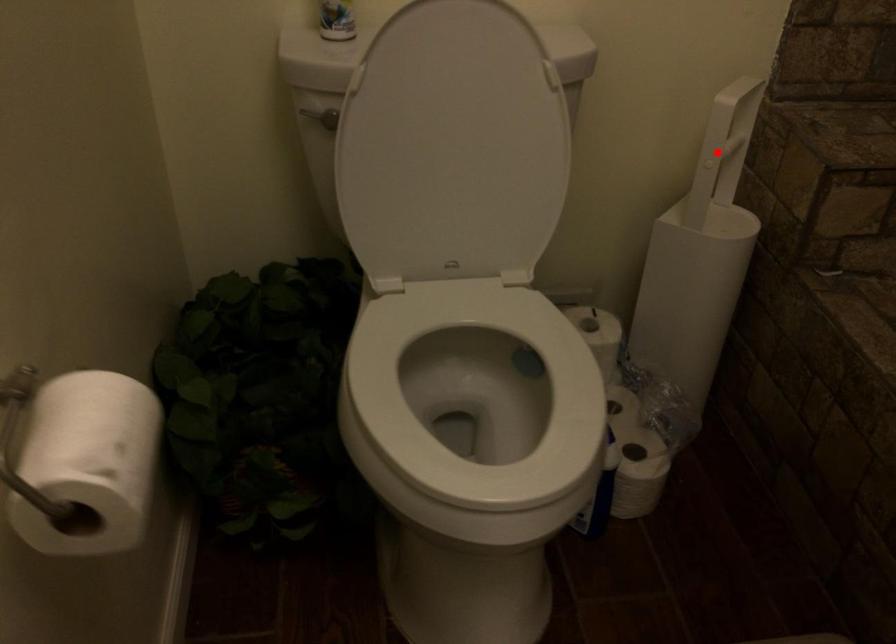
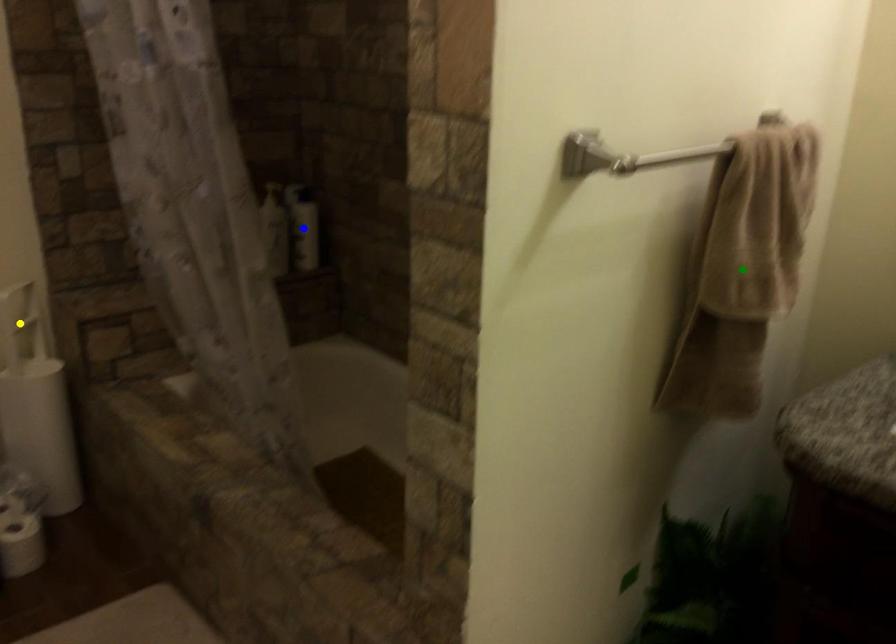
Question: I am providing you with two images of the same scene from different viewpoints. A red point is marked on the first image. You are given multiple points on the second image. Which spot in image 2 lines up with the point in image 1?

Choices:
 (A) yellow point
 (B) green point
 (C) blue point

Answer: (A)